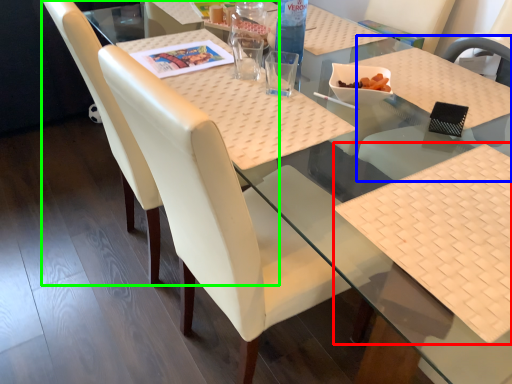
Question: Estimate the real-world distances between objects in this image. Which object is farther from place mat (highlighted by a red box), chair (highlighted by a blue box) or chair (highlighted by a green box)?

Choices:
 (A) chair
 (B) chair

Answer: (B)